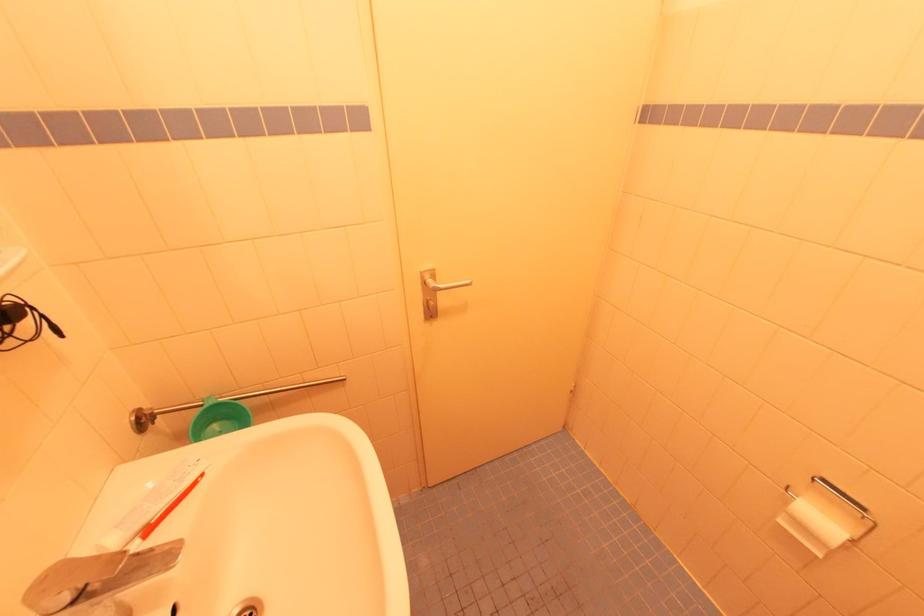
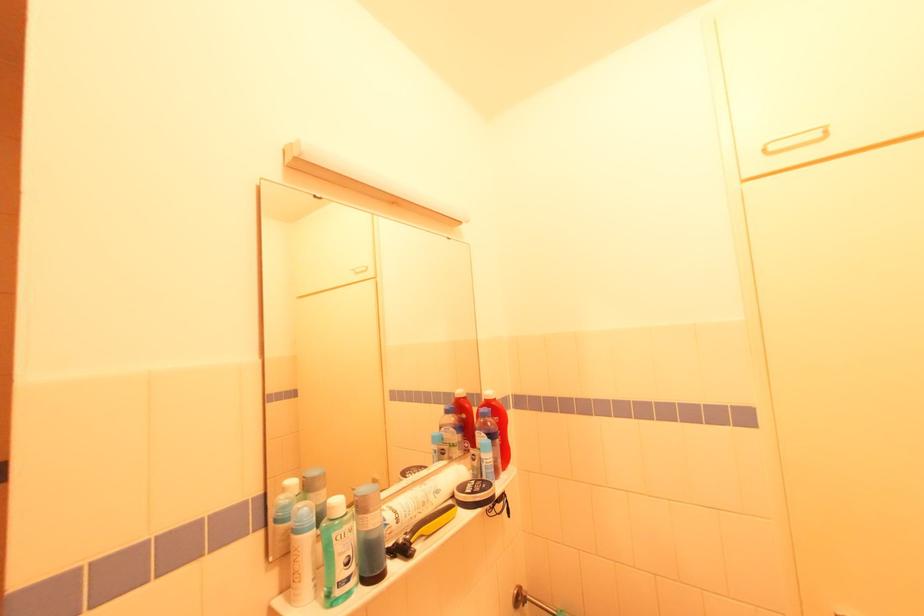
Find the pixel in the second image that matches (x=135, y=419) in the first image.

(517, 594)